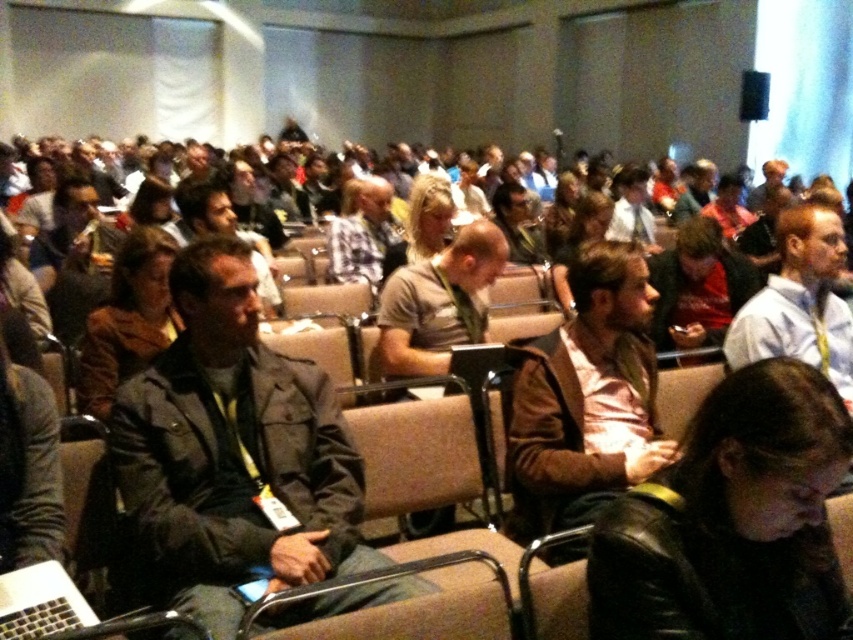
Question: Which point is farther to the camera?

Choices:
 (A) brown fuzzy coat at center
 (B) red shirt at center

Answer: (B)

Question: Is black leather jacket at lower right positioned behind brown leather jacket at center?

Choices:
 (A) yes
 (B) no

Answer: (B)

Question: Which point is farther from the camera taking this photo?

Choices:
 (A) (534, 472)
 (B) (187, 317)
 (C) (732, 289)
 (D) (77, 372)

Answer: (C)

Question: Does black leather jacket at lower right have a lesser width compared to red shirt at center?

Choices:
 (A) no
 (B) yes

Answer: (B)

Question: Where is dark gray jacket at center located in relation to brown leather jacket at center in the image?

Choices:
 (A) below
 (B) above

Answer: (A)

Question: Which of the following is the closest to the observer?

Choices:
 (A) (508, 228)
 (B) (131, 321)
 (C) (648, 280)
 (D) (550, 557)

Answer: (D)